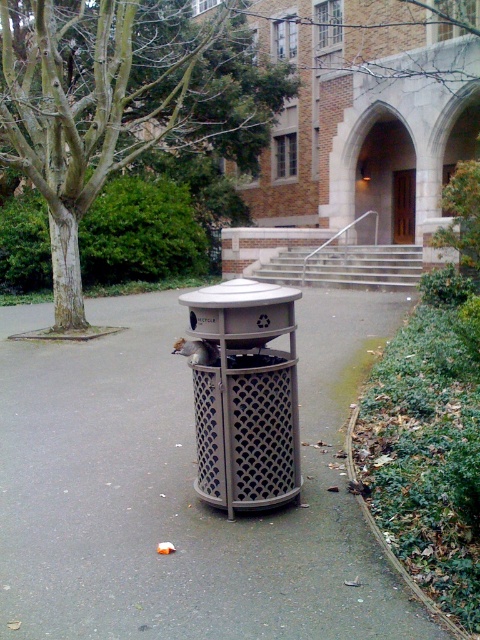
Based on the photo, you are standing on the paved pathway and see the brushed metal trash can at center and the green leafy tree at center. Which object is positioned to the left of the other?

The green leafy tree at center is to the left of the brushed metal trash can at center.

You are a park visitor standing on the paved pathway. You want to place a large leaf from the green leafy tree at center into the metallic mesh trash can at center. Can you directly drop the leaf into the trash can without moving closer?

The green leafy tree at center is above the metallic mesh trash can at center, so the leaf might naturally fall into the trash can if dropped from above.

You are a sanitation worker who needs to collect trash from two cans placed along a pathway. You are standing at the starting point and see the brushed metal trash can at center and the metallic mesh trash can at center. Which trash can should you approach first if you want to minimize the total distance walked?

The total distance walked will be the same regardless of the order since both the brushed metal trash can at center and the metallic mesh trash can at center are located at the same central position on the pathway. The distance between them is 3.66 meters, but since they are both at the center, approaching either first won t change the total distance required.